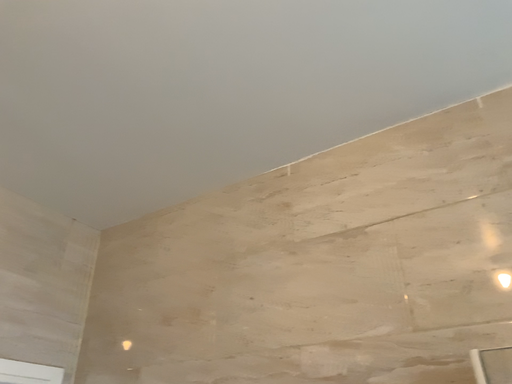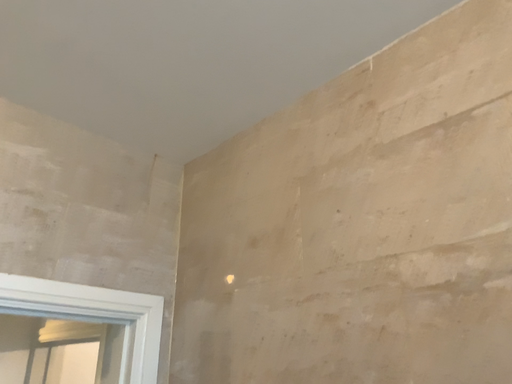
Question: Which way did the camera rotate in the video?

Choices:
 (A) rotated upward
 (B) rotated downward

Answer: (B)